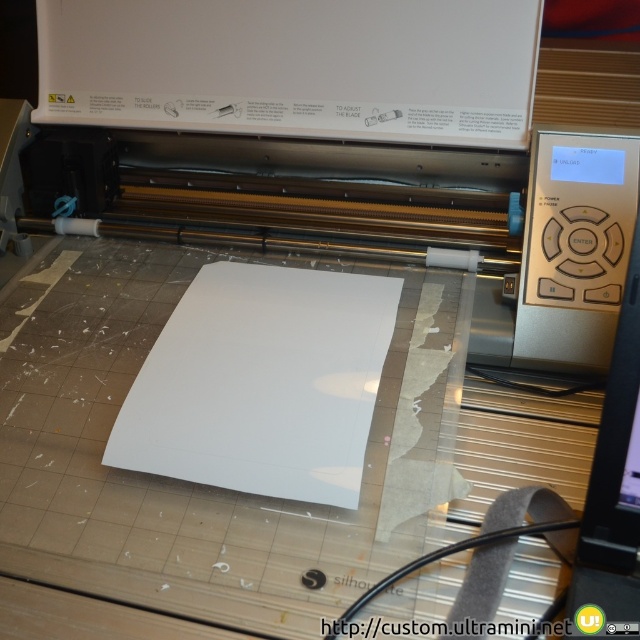
How much distance is there between metallic silver printer at center and white matte paper at center?

metallic silver printer at center and white matte paper at center are 7.98 inches apart from each other.

Is point (70, 129) positioned in front of point (316, 435)?

No, it is not.

Does point (244, 188) come closer to viewer compared to point (220, 468)?

No, it is behind (220, 468).

This screenshot has width=640, height=640. Find the location of `metallic silver printer at center`. metallic silver printer at center is located at coordinates (397, 212).